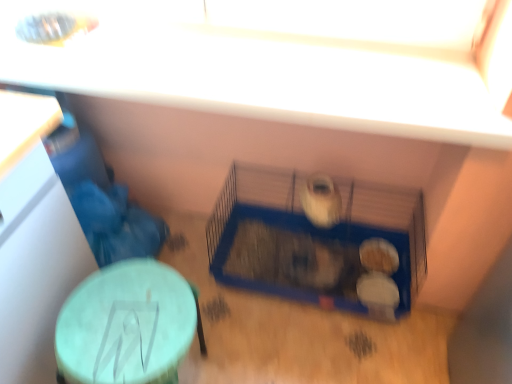
Find the location of `unoccupied space behind blue plastic cage at center`. unoccupied space behind blue plastic cage at center is located at coordinates (260, 246).